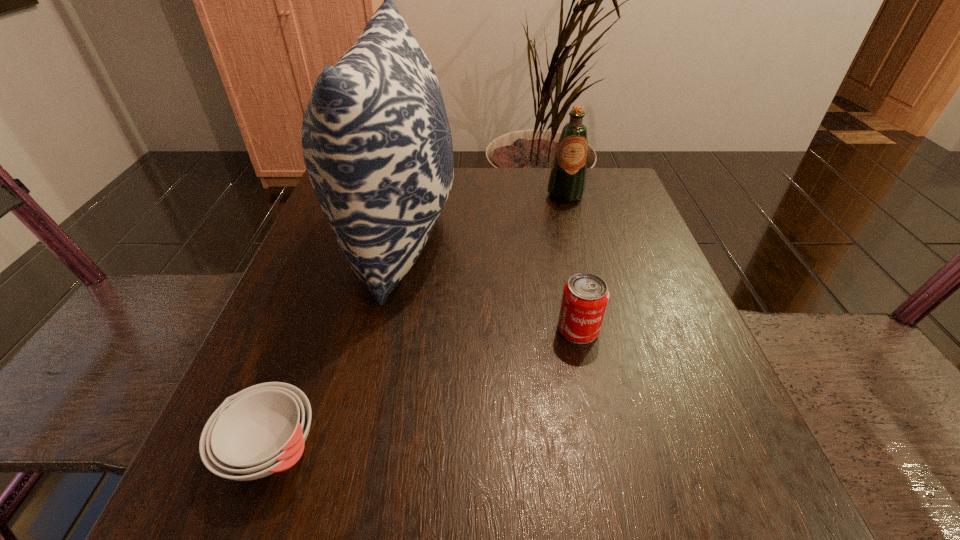
I want to click on olive oil present at the far edge, so point(567,181).

Identify the location of object at the near edge. (260, 430).

The height and width of the screenshot is (540, 960). In order to click on cushion situated at the left edge in this screenshot , I will do `click(376, 140)`.

At what (x,y) coordinates should I click in order to perform the action: click on soup bowl positioned at the left edge. Please return your answer as a coordinate pair (x, y). This screenshot has height=540, width=960. Looking at the image, I should click on (260, 430).

This screenshot has width=960, height=540. I want to click on olive oil that is at the right edge, so click(567, 181).

At what (x,y) coordinates should I click in order to perform the action: click on can that is at the right edge. Please return your answer as a coordinate pair (x, y). Looking at the image, I should click on (585, 296).

This screenshot has height=540, width=960. What are the coordinates of `object located at the far left corner` in the screenshot? It's located at (376, 140).

This screenshot has width=960, height=540. Identify the location of object located in the near left corner section of the desktop. (260, 430).

This screenshot has width=960, height=540. I want to click on object that is at the far right corner, so click(x=567, y=181).

The width and height of the screenshot is (960, 540). Find the location of `free spot at the far edge of the desktop`. free spot at the far edge of the desktop is located at coordinates (484, 215).